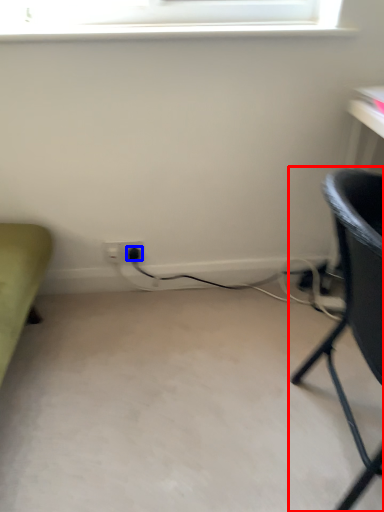
Question: Which of the following is the closest to the observer, chair (highlighted by a red box) or plug (highlighted by a blue box)?

Choices:
 (A) chair
 (B) plug

Answer: (A)